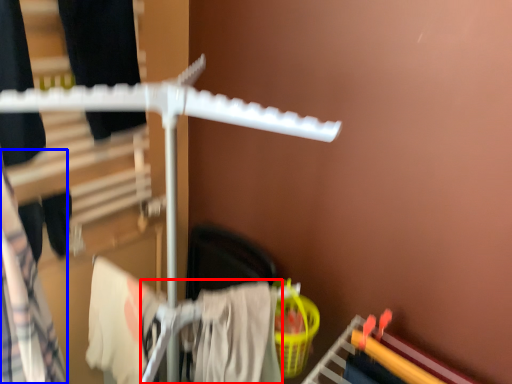
Question: Which object is further to the camera taking this photo, clothing (highlighted by a red box) or clothing (highlighted by a blue box)?

Choices:
 (A) clothing
 (B) clothing

Answer: (A)